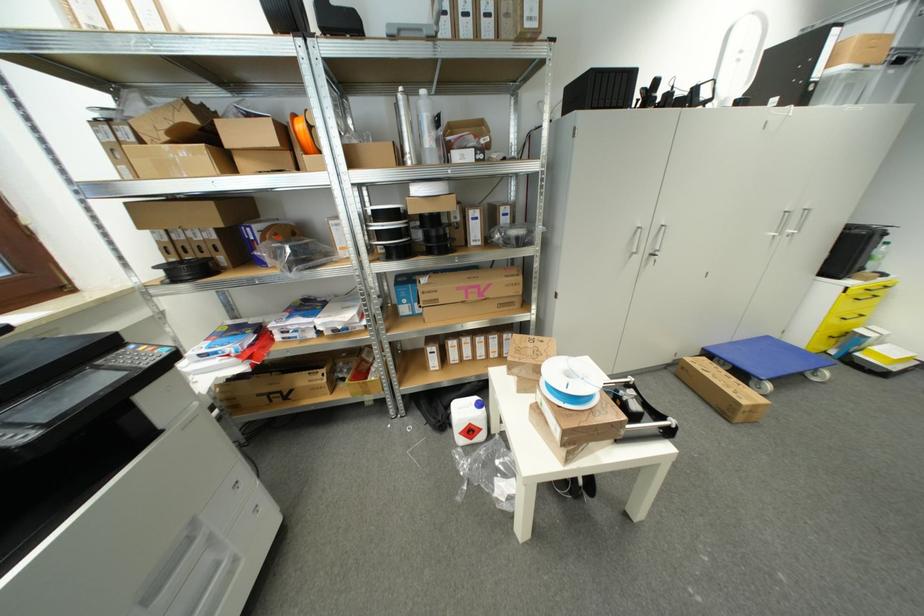
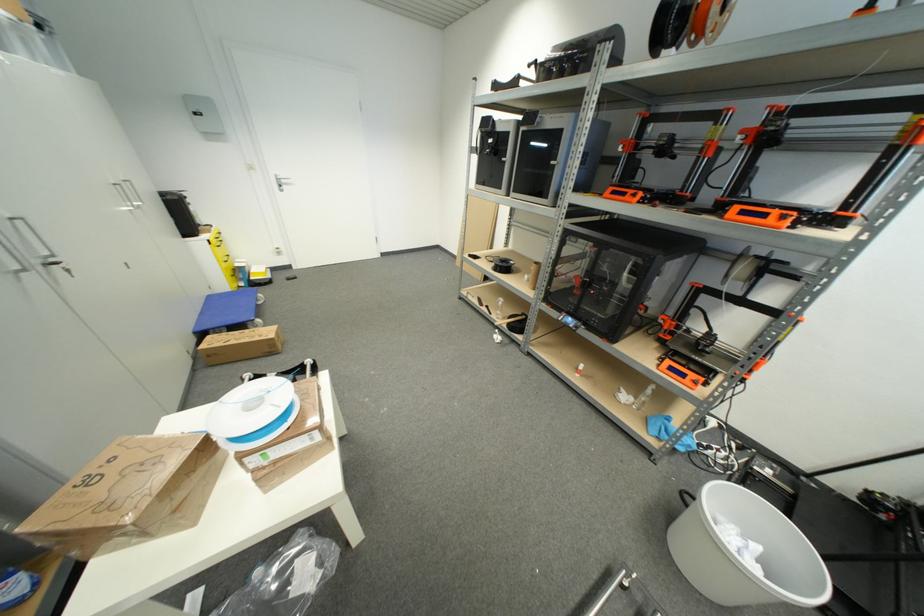
Where in the second image is the point corresponding to [709,361] from the first image?

(213, 339)